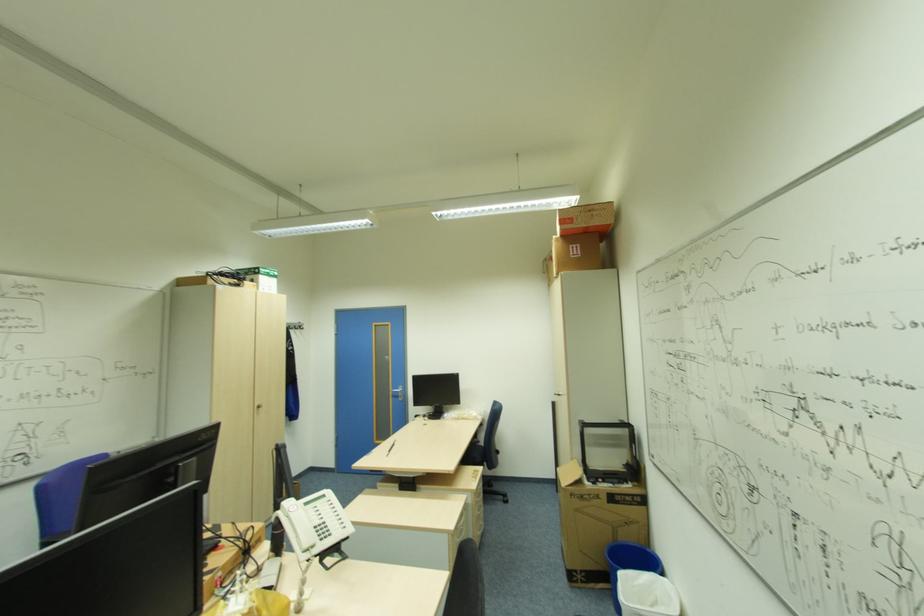
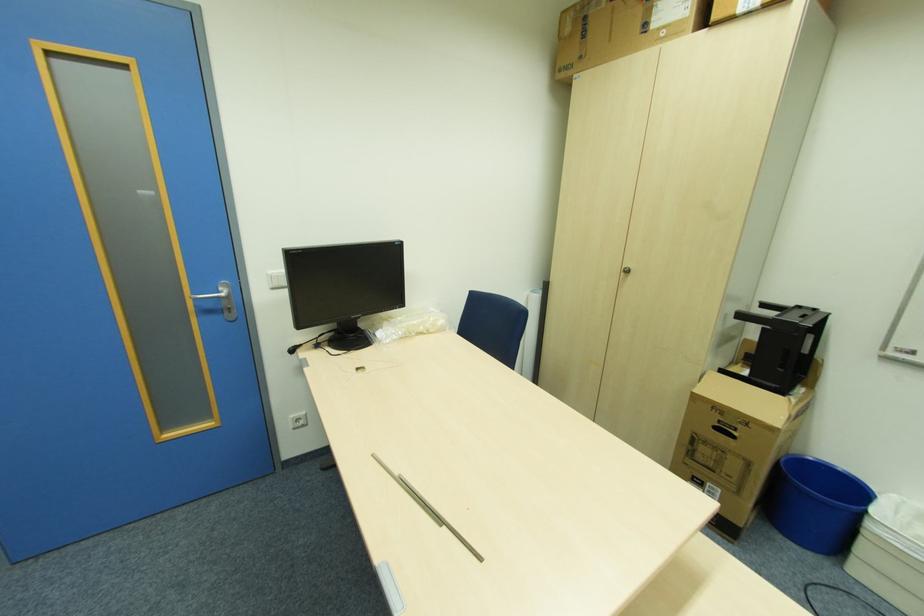
The point at (467, 416) is marked in the first image. Where is the corresponding point in the second image?

(424, 329)